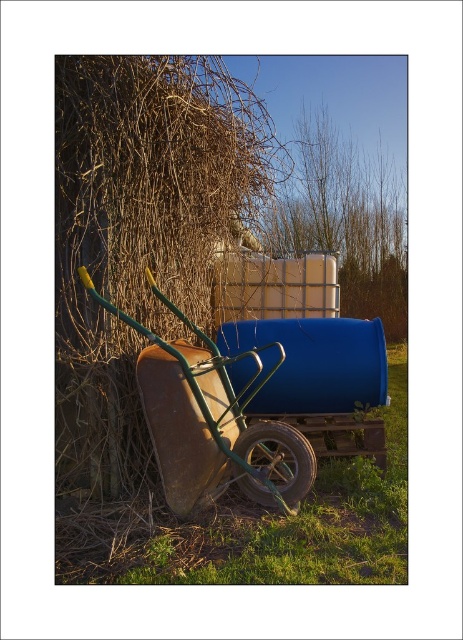
You are standing in the outdoor scene described. You need to place a small potted plant between the green grass at lower center and the rusty metal cart at left. Based on their positions, where should you position the potted plant?

The green grass at lower center is located below the rusty metal cart at left, so you should place the potted plant between them by positioning it under the rusty metal cart at left and above the green grass at lower center.

You are standing in the scene and need to cross from the left side to the right side. The rusty metal cart at left is blocking your path. Can you walk around it on the side where the green grass at lower center is wider?

The green grass at lower center is wider than the rusty metal cart at left, so yes, you can walk around the rusty metal cart at left on the side where the green grass at lower center is wider.

You are standing in the scene and want to place a small potted plant. Which area has more space, the green grass at lower center or the rusty metal cart at left?

The green grass at lower center has more space because it is bigger than the rusty metal cart at left.